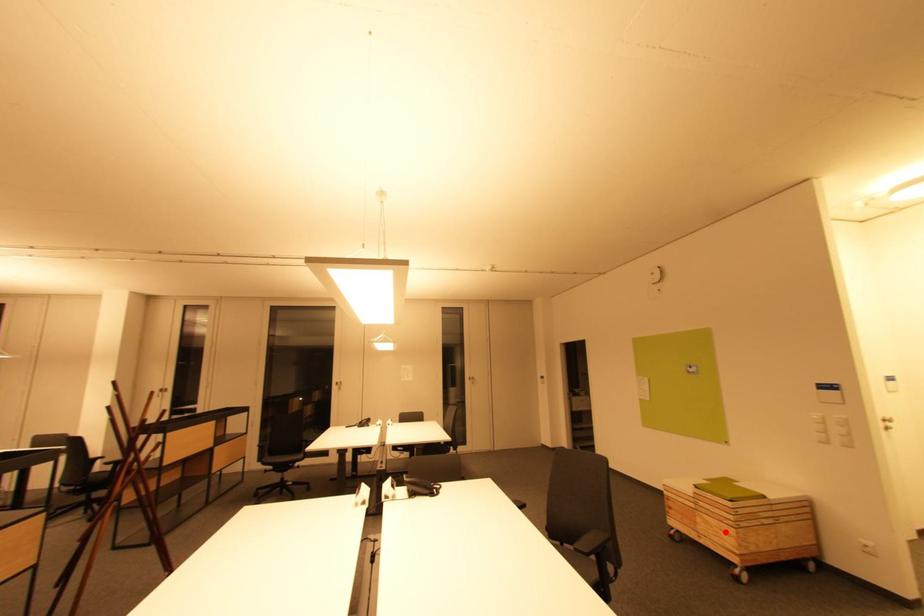
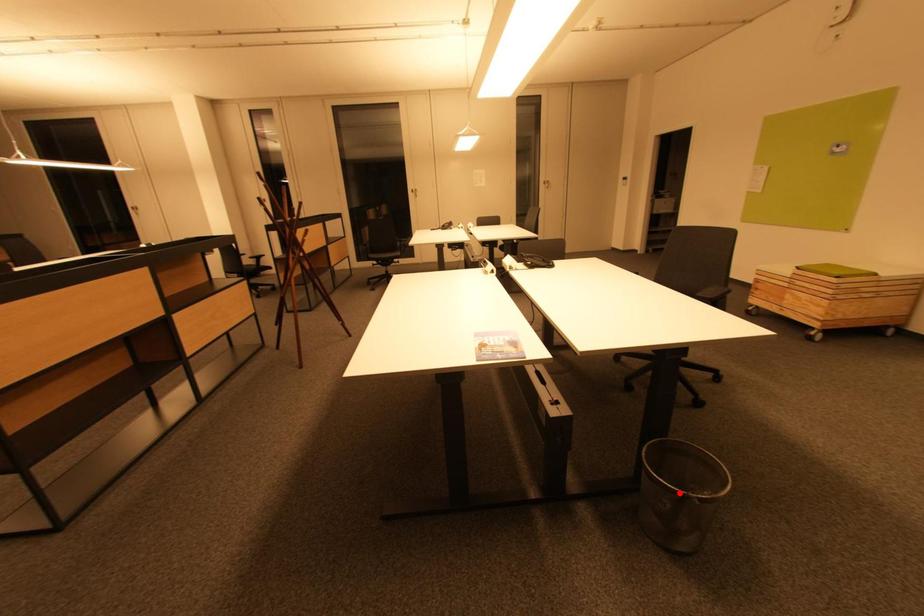
I am providing you with two images of the same scene from different viewpoints. A red point is marked on the first image and another point is marked on the second image. Is the red point in image1 aligned with the point shown in image2?

No